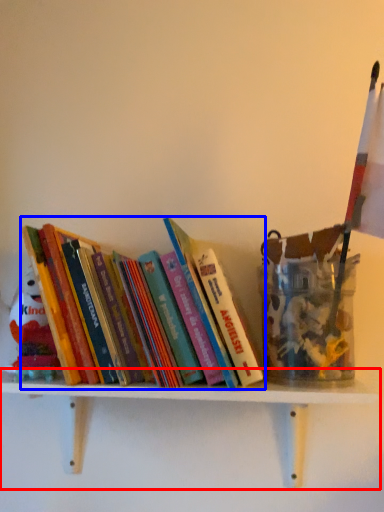
Question: Which of the following is the farthest to the observer, shelf (highlighted by a red box) or book (highlighted by a blue box)?

Choices:
 (A) shelf
 (B) book

Answer: (B)